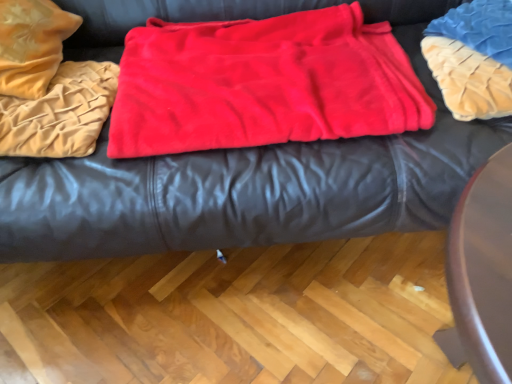
Question: From the image's perspective, relative to red fleece blanket at center, marked as the 1th blanket in a right-to-left arrangement, is velvet beige blanket at left, the 1th blanket in the left-to-right sequence, above or below?

Choices:
 (A) below
 (B) above

Answer: (A)

Question: Based on their sizes in the image, would you say velvet beige blanket at left, the 1th blanket in the left-to-right sequence, is bigger or smaller than red fleece blanket at center, which is the second blanket from left to right?

Choices:
 (A) big
 (B) small

Answer: (B)

Question: Which of these objects is positioned farthest from the velvet beige blanket at left, the 1th blanket in the left-to-right sequence?

Choices:
 (A) red fleece blanket at center, marked as the 1th blanket in a right-to-left arrangement
 (B) blue textured pillow at upper right
 (C) velvet-like red blanket at center

Answer: (B)

Question: Estimate the real-world distances between objects in this image. Which object is closer to the velvet beige blanket at left, placed as the second blanket when sorted from right to left?

Choices:
 (A) blue textured pillow at upper right
 (B) red fleece blanket at center, which is the second blanket from left to right
 (C) velvet-like red blanket at center

Answer: (C)